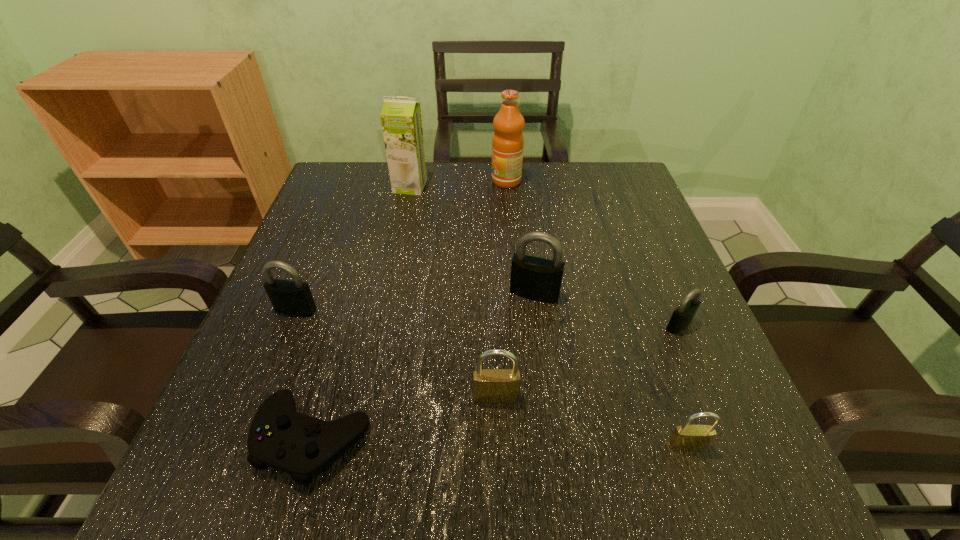
Where is `green soya milk`? green soya milk is located at coordinates (401, 121).

Image resolution: width=960 pixels, height=540 pixels. I want to click on fruit juice, so click(x=508, y=142).

Locate an element on the screen. The width and height of the screenshot is (960, 540). the second black padlock from right to left is located at coordinates (538, 279).

Identify the location of the tallest padlock. This screenshot has height=540, width=960. (538, 279).

The image size is (960, 540). I want to click on the leftmost padlock, so click(x=294, y=297).

The width and height of the screenshot is (960, 540). In order to click on the second biggest black padlock in this screenshot , I will do `click(294, 297)`.

Where is `the left brass padlock`? This screenshot has width=960, height=540. the left brass padlock is located at coordinates (490, 385).

Where is `the farther brass padlock`? The height and width of the screenshot is (540, 960). the farther brass padlock is located at coordinates (490, 385).

Identify the location of the third nearest padlock. Image resolution: width=960 pixels, height=540 pixels. (683, 315).

The image size is (960, 540). In order to click on the rightmost padlock in this screenshot , I will do `click(683, 315)`.